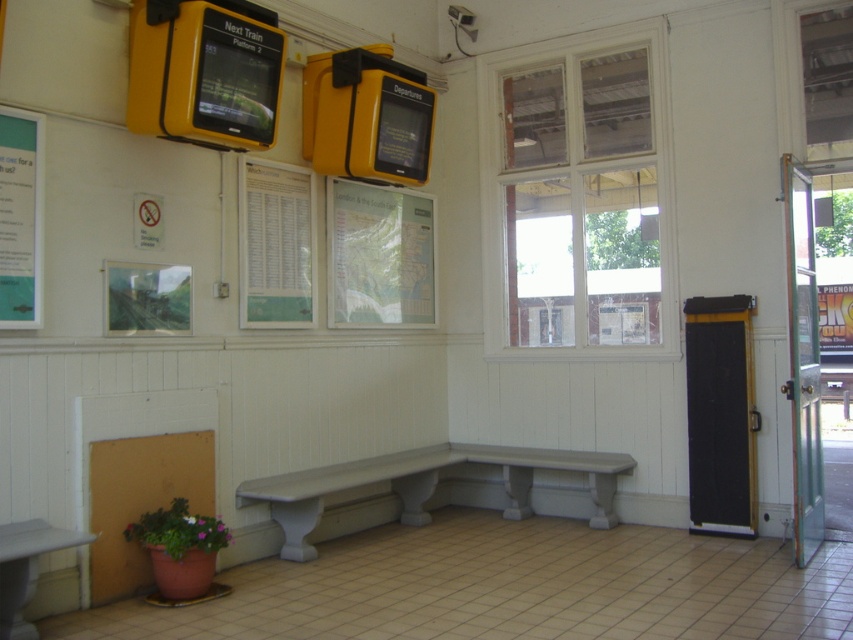
Is point (808, 342) positioned before point (35, 285)?

No, it is behind (35, 285).

Is point (801, 413) farther from viewer compared to point (18, 232)?

Yes, it is.

Locate an element on the screen. clear glass door at right is located at coordinates (802, 358).

Locate an element on the screen. clear glass door at right is located at coordinates (802, 358).

In the scene shown: Between clear glass door at right and smooth gray bench at center, which one is positioned lower?

smooth gray bench at center

Is clear glass door at right further to the viewer compared to smooth gray bench at center?

No, clear glass door at right is closer to the viewer.

Does point (805, 237) come farther from viewer compared to point (511, 497)?

No, it is in front of (511, 497).

The image size is (853, 640). What are the coordinates of `clear glass door at right` in the screenshot? It's located at (802, 358).

Does black wood door at right have a greater height compared to clear glass door at right?

No, black wood door at right is not taller than clear glass door at right.

Does black wood door at right appear on the left side of clear glass door at right?

Indeed, black wood door at right is positioned on the left side of clear glass door at right.

Between point (693, 401) and point (798, 413), which one is positioned behind?

Positioned behind is point (693, 401).

Where is `black wood door at right`? black wood door at right is located at coordinates (720, 413).